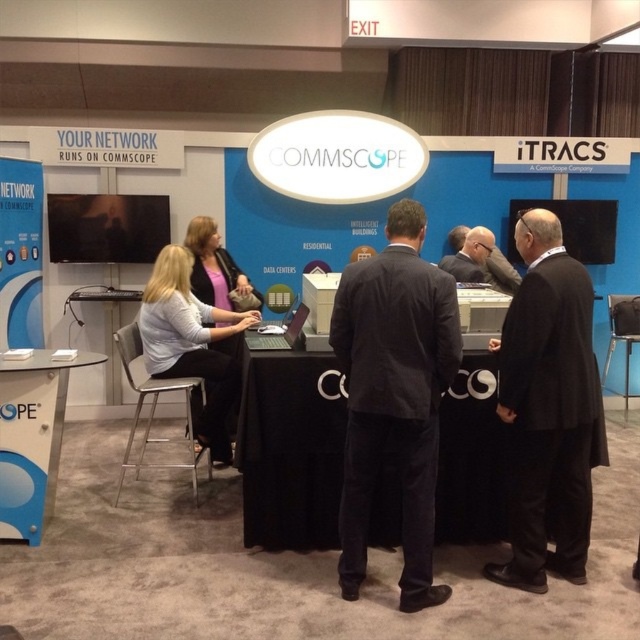
Between dark gray suit at center and matte black laptop at center, which one appears on the right side from the viewer's perspective?

dark gray suit at center is more to the right.

What do you see at coordinates (394, 396) in the screenshot?
I see `dark gray suit at center` at bounding box center [394, 396].

The width and height of the screenshot is (640, 640). I want to click on dark gray suit at center, so click(394, 396).

Is black wool coat at center behind black suit at center?

No, black wool coat at center is in front of black suit at center.

Between black wool coat at center and black suit at center, which one is positioned lower?

black wool coat at center is lower down.

Image resolution: width=640 pixels, height=640 pixels. I want to click on black wool coat at center, so click(x=548, y=408).

Identify the location of black wool coat at center. The height and width of the screenshot is (640, 640). (548, 408).

Who is more distant from viewer, [278,378] or [289,316]?

Positioned behind is point [289,316].

What do you see at coordinates (291, 449) in the screenshot? I see `black fabric table at center` at bounding box center [291, 449].

What do you see at coordinates (291, 449) in the screenshot?
I see `black fabric table at center` at bounding box center [291, 449].

Where is `black fabric table at center`? The width and height of the screenshot is (640, 640). black fabric table at center is located at coordinates (291, 449).